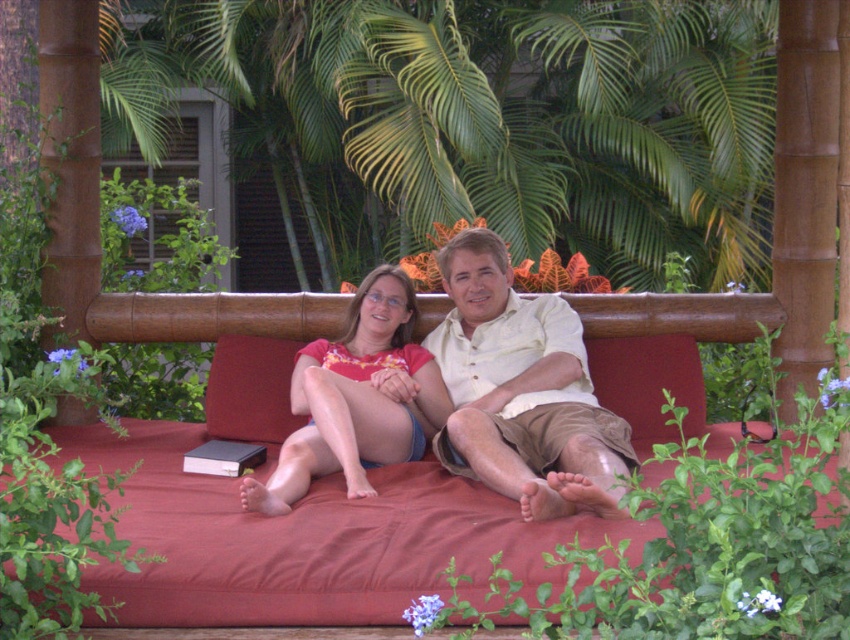
You are standing in a tropical garden and see a point marked at coordinates (520, 390). According to the image, which object is this point located on?

The point at coordinates (520, 390) is located on the light beige cotton shirt at center.

You are a tailor who needs to determine which shirt requires more fabric between the light beige cotton shirt at center and the matte orange shirt at center. Based on their sizes, which one would need more fabric?

The light beige cotton shirt at center requires more fabric because it is bigger than the matte orange shirt at center.

You are a photographer trying to capture a clear shot of both the light beige cotton shirt at center and the matte orange shirt at center. Since you want both shirts to be in focus, which one should you adjust your camera focus on first?

You should focus on the light beige cotton shirt at center first because it is closer to the viewer than the matte orange shirt at center. By focusing on the closer object, you can ensure that the depth of field will cover both shirts in the frame.